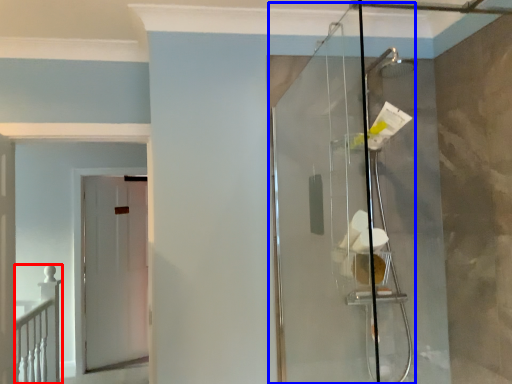
Question: Which point is closer to the camera, rail (highlighted by a red box) or glass door (highlighted by a blue box)?

Choices:
 (A) rail
 (B) glass door

Answer: (B)